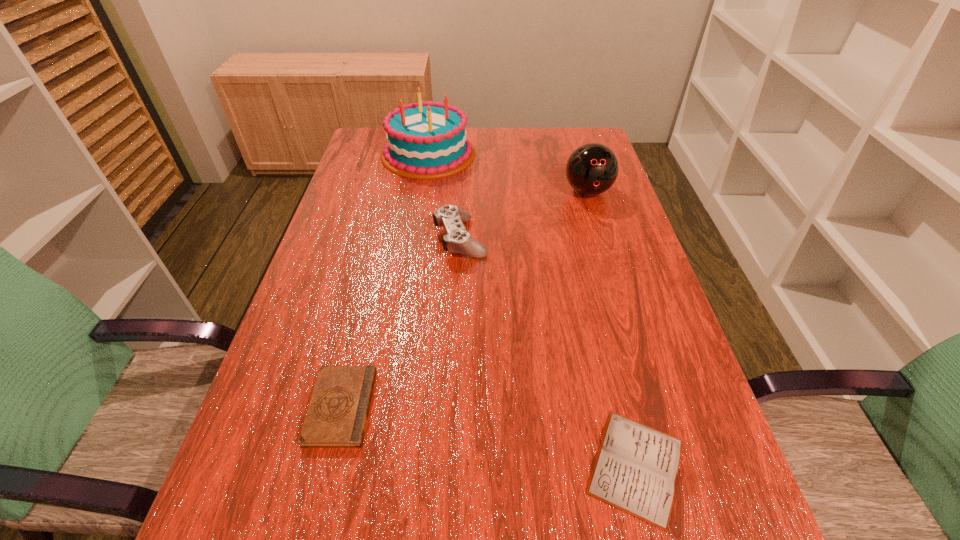
You are a GUI agent. You are given a task and a screenshot of the screen. Output one action in this format:
    pyautogui.click(x=<x>, y=<y>)
    Task: Click on the vacant point located on the back of the third shortest object
    
    Given the screenshot: What is the action you would take?
    pyautogui.click(x=463, y=184)

Locate an element on the screen. free location located on the spine side of the taller diary is located at coordinates (523, 407).

The image size is (960, 540). What are the coordinates of `free space located on the left of the shorter diary` in the screenshot? It's located at (381, 466).

The width and height of the screenshot is (960, 540). I want to click on object that is at the far edge, so click(426, 140).

This screenshot has width=960, height=540. I want to click on birthday cake that is at the left edge, so click(x=426, y=140).

What are the coordinates of `diary that is at the left edge` in the screenshot? It's located at (337, 415).

This screenshot has height=540, width=960. Find the location of `bowling ball at the right edge`. bowling ball at the right edge is located at coordinates (591, 169).

This screenshot has height=540, width=960. Find the location of `diary that is positioned at the right edge`. diary that is positioned at the right edge is located at coordinates (636, 468).

Find the location of a particular element. The image size is (960, 540). object that is at the far left corner is located at coordinates (426, 140).

Where is `free space at the far edge of the desktop`? The height and width of the screenshot is (540, 960). free space at the far edge of the desktop is located at coordinates (496, 162).